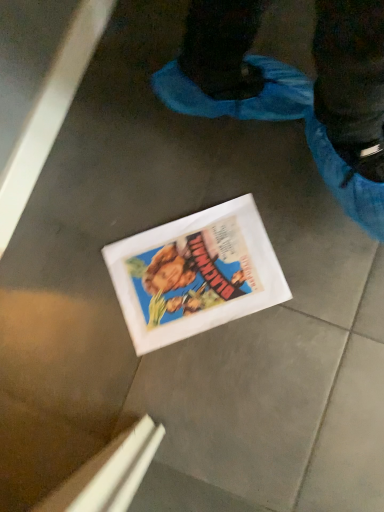
Where is `free space above white paper flyer at center (from a real-world perspective)`? free space above white paper flyer at center (from a real-world perspective) is located at coordinates (197, 272).